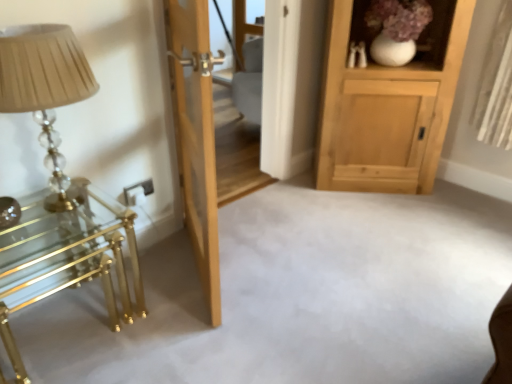
Question: In terms of height, does natural wood door at center look taller or shorter compared to white ceramic vase at upper right?

Choices:
 (A) tall
 (B) short

Answer: (A)

Question: Considering the positions of point (202, 11) and point (433, 13), is point (202, 11) closer or farther from the camera than point (433, 13)?

Choices:
 (A) farther
 (B) closer

Answer: (B)

Question: Which object is the farthest from the transparent glass door at center?

Choices:
 (A) natural wood cabinet at upper right
 (B) polished brass table at left
 (C) translucent glass table lamp at left
 (D) natural wood door at center
 (E) white ceramic vase at upper right

Answer: (B)

Question: Estimate the real-world distances between objects in this image. Which object is closer to the polished brass table at left?

Choices:
 (A) white ceramic vase at upper right
 (B) natural wood door at center
 (C) transparent glass door at center
 (D) natural wood cabinet at upper right
 (E) translucent glass table lamp at left

Answer: (E)